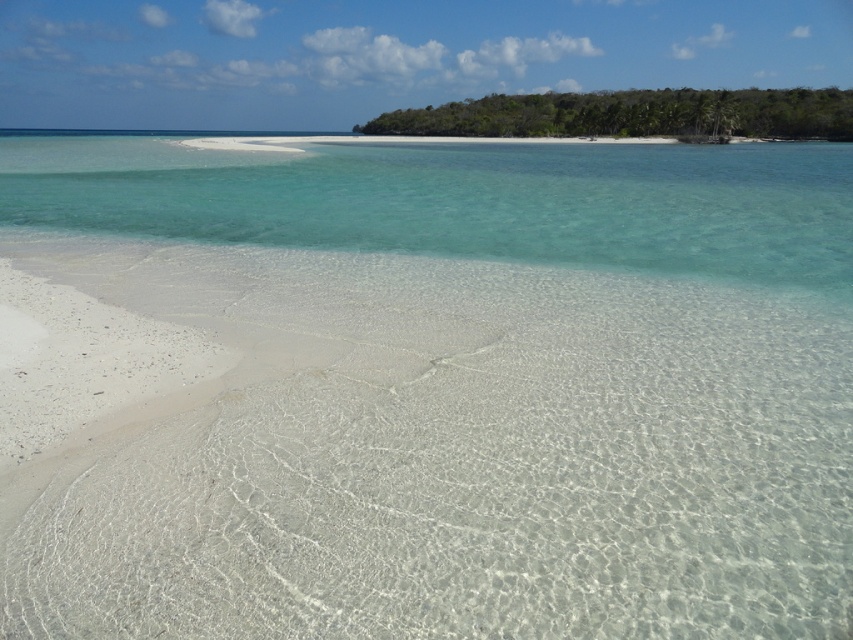
Can you confirm if white sand at lower left is taller than clear water at center?

Incorrect, white sand at lower left's height is not larger of clear water at center's.

Who is lower down, white sand at lower left or clear water at center?

Positioned lower is white sand at lower left.

This screenshot has height=640, width=853. Find the location of `white sand at lower left`. white sand at lower left is located at coordinates (451, 458).

Does clear water at center have a lesser height compared to green leafy island at upper right?

Yes, clear water at center is shorter than green leafy island at upper right.

Who is more distant from viewer, (508, 256) or (779, 104)?

The point (779, 104) is behind.

This screenshot has width=853, height=640. In order to click on clear water at center in this screenshot , I will do `click(463, 202)`.

Consider the image. Does white sand at lower left appear on the left side of green leafy island at upper right?

Indeed, white sand at lower left is positioned on the left side of green leafy island at upper right.

Which is in front, point (467, 385) or point (810, 113)?

Point (467, 385) is more forward.

Identify the location of white sand at lower left. This screenshot has height=640, width=853. (451, 458).